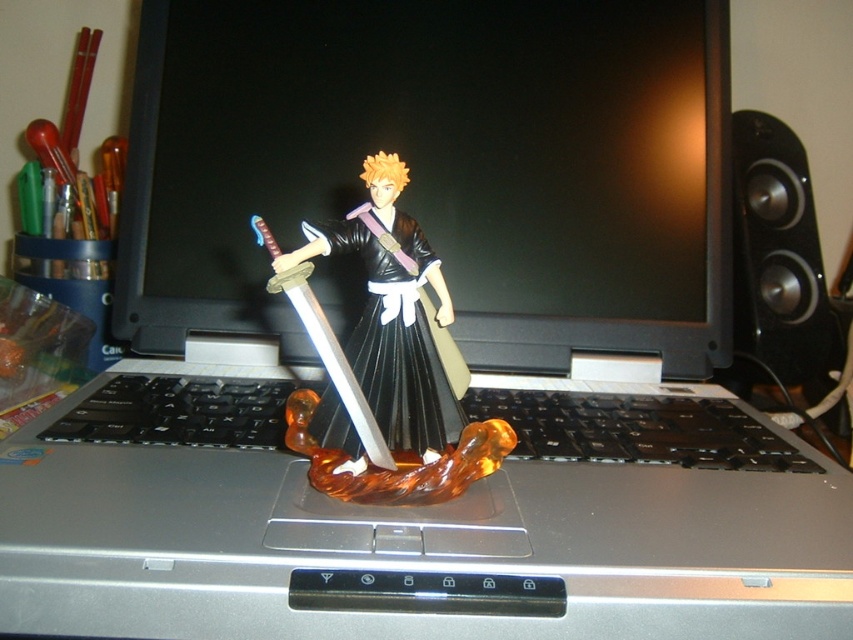
You are setting up a desk and want to place both the translucent amber base at center and the black plastic speaker at right on your desk. Based on their positions in the image, which object is closer to the edge of the desk?

The black plastic speaker at right is closer to the edge of the desk because it is positioned above the translucent amber base at center, which is located below it.

You are trying to place a small plant between the black plastic speaker at right and the shiny silver sword at center on the laptop keyboard. Considering their heights, which object should you place the plant closer to to ensure it doesn

The black plastic speaker at right is much taller than the shiny silver sword at center. To ensure the plant is stable, place it closer to the black plastic speaker at right since its height provides better support.